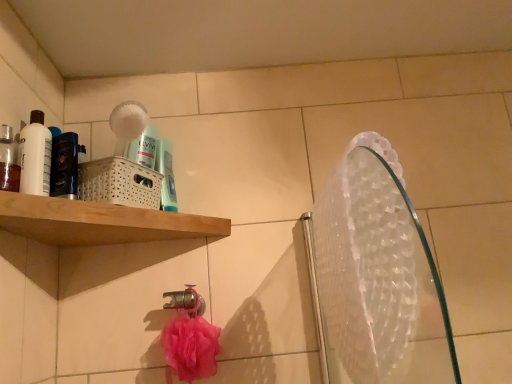
Question: From the image's perspective, is metallic chrome tap at lower center located beneath blue glossy mouthwash at upper center, the first mouthwash positioned from the right?

Choices:
 (A) no
 (B) yes

Answer: (B)

Question: Is metallic chrome tap at lower center facing towards blue glossy mouthwash at upper center, which is the first mouthwash in back-to-front order?

Choices:
 (A) no
 (B) yes

Answer: (A)

Question: Considering the relative sizes of metallic chrome tap at lower center and blue glossy mouthwash at upper center, which is counted as the third mouthwash, starting from the left, in the image provided, is metallic chrome tap at lower center smaller than blue glossy mouthwash at upper center, which is counted as the third mouthwash, starting from the left,?

Choices:
 (A) no
 (B) yes

Answer: (A)

Question: Is metallic chrome tap at lower center shorter than blue glossy mouthwash at upper center, the first mouthwash positioned from the right?

Choices:
 (A) no
 (B) yes

Answer: (B)

Question: Is metallic chrome tap at lower center not within blue glossy mouthwash at upper center, which is the 3th mouthwash in front-to-back order?

Choices:
 (A) no
 (B) yes

Answer: (B)

Question: In terms of size, does translucent plastic mouthwash at left, the third mouthwash from the back, appear bigger or smaller than metallic chrome tap at lower center?

Choices:
 (A) big
 (B) small

Answer: (B)

Question: Which is correct: translucent plastic mouthwash at left, which is counted as the 1th mouthwash, starting from the front, is inside metallic chrome tap at lower center, or outside of it?

Choices:
 (A) outside
 (B) inside

Answer: (A)

Question: From a real-world perspective, relative to metallic chrome tap at lower center, is translucent plastic mouthwash at left, acting as the third mouthwash starting from the right, vertically above or below?

Choices:
 (A) above
 (B) below

Answer: (A)

Question: Looking at their shapes, would you say translucent plastic mouthwash at left, which is counted as the 1th mouthwash, starting from the front, is wider or thinner than metallic chrome tap at lower center?

Choices:
 (A) wide
 (B) thin

Answer: (B)

Question: From the image's perspective, is metallic chrome tap at lower center located above or below transparent plastic mirror at upper right?

Choices:
 (A) below
 (B) above

Answer: (A)

Question: In terms of height, does metallic chrome tap at lower center look taller or shorter compared to transparent plastic mirror at upper right?

Choices:
 (A) short
 (B) tall

Answer: (A)

Question: Is metallic chrome tap at lower center wider or thinner than transparent plastic mirror at upper right?

Choices:
 (A) thin
 (B) wide

Answer: (A)

Question: Considering the positions of metallic chrome tap at lower center and transparent plastic mirror at upper right in the image, is metallic chrome tap at lower center bigger or smaller than transparent plastic mirror at upper right?

Choices:
 (A) small
 (B) big

Answer: (A)

Question: From a real-world perspective, relative to blue glossy mouthwash at upper center, the first mouthwash positioned from the right, is transparent plastic mirror at upper right vertically above or below?

Choices:
 (A) above
 (B) below

Answer: (B)

Question: Visually, is transparent plastic mirror at upper right positioned to the left or to the right of blue glossy mouthwash at upper center, the first mouthwash positioned from the right?

Choices:
 (A) right
 (B) left

Answer: (A)